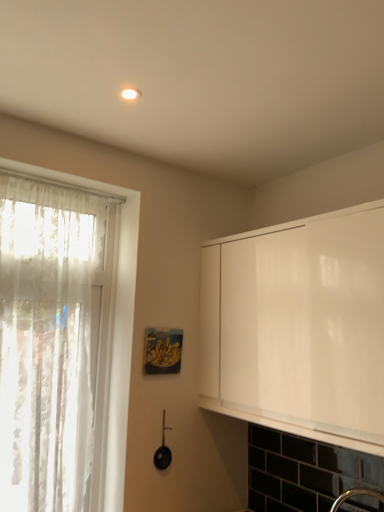
Describe the element at coordinates (298, 327) in the screenshot. This screenshot has height=512, width=384. I see `white matte cabinet at right` at that location.

The image size is (384, 512). What are the coordinates of `matte wooden picture frame at center` in the screenshot? It's located at (163, 351).

Looking at this image, between matte wooden picture frame at center and white matte cabinet at right, which one has less height?

matte wooden picture frame at center.

Based on their positions, is matte wooden picture frame at center located to the left or right of white matte cabinet at right?

Based on their positions, matte wooden picture frame at center is located to the left of white matte cabinet at right.

Does matte wooden picture frame at center touch white matte cabinet at right?

No, matte wooden picture frame at center is not beside white matte cabinet at right.

Where is `picture frame below the white matte cabinet at right (from the image's perspective)`? picture frame below the white matte cabinet at right (from the image's perspective) is located at coordinates (163, 351).

Measure the distance between white lace curtain at left and white matte cabinet at right.

white lace curtain at left is 81.24 centimeters away from white matte cabinet at right.

Could you tell me if white lace curtain at left is turned towards white matte cabinet at right?

No, white lace curtain at left does not turn towards white matte cabinet at right.

Which point is more distant from viewer, (61, 372) or (345, 355)?

Positioned behind is point (61, 372).

From the picture: Considering the positions of objects white lace curtain at left and white matte cabinet at right in the image provided, who is more to the left, white lace curtain at left or white matte cabinet at right?

Positioned to the left is white lace curtain at left.

From a real-world perspective, is white matte cabinet at right on white lace curtain at left?

Indeed, from a real-world perspective, white matte cabinet at right stands above white lace curtain at left.

Considering the positions of point (251, 242) and point (59, 494), is point (251, 242) closer or farther from the camera than point (59, 494)?

Point (251, 242).

Which object is wider, white matte cabinet at right or white lace curtain at left?

white matte cabinet at right is wider.

Could you tell me if white matte cabinet at right is facing white lace curtain at left?

Yes, white matte cabinet at right is facing white lace curtain at left.

Could you tell me if white matte cabinet at right is turned towards matte wooden picture frame at center?

Yes, white matte cabinet at right faces towards matte wooden picture frame at center.

Can you confirm if white matte cabinet at right is smaller than matte wooden picture frame at center?

Incorrect, white matte cabinet at right is not smaller in size than matte wooden picture frame at center.

Is white matte cabinet at right at the left side of matte wooden picture frame at center?

No, white matte cabinet at right is not to the left of matte wooden picture frame at center.

Considering the sizes of matte wooden picture frame at center and white lace curtain at left in the image, is matte wooden picture frame at center bigger or smaller than white lace curtain at left?

In the image, matte wooden picture frame at center appears to be smaller than white lace curtain at left.

Which is more to the left, matte wooden picture frame at center or white lace curtain at left?

Positioned to the left is white lace curtain at left.

Is matte wooden picture frame at center wider than white lace curtain at left?

No.

Do you think matte wooden picture frame at center is within white lace curtain at left, or outside of it?

matte wooden picture frame at center exists outside the volume of white lace curtain at left.

Considering the sizes of objects white lace curtain at left and matte wooden picture frame at center in the image provided, who is wider, white lace curtain at left or matte wooden picture frame at center?

white lace curtain at left is wider.

From a real-world perspective, relative to matte wooden picture frame at center, is white lace curtain at left vertically above or below?

white lace curtain at left is above matte wooden picture frame at center.

Identify the location of picture frame lying on the right of white lace curtain at left. This screenshot has width=384, height=512. pos(163,351).

Is white lace curtain at left far from matte wooden picture frame at center?

No, white lace curtain at left is not far away from matte wooden picture frame at center.

Identify the location of cabinetry above the matte wooden picture frame at center (from the image's perspective). This screenshot has width=384, height=512. (298, 327).

Find the location of `curtain below the white matte cabinet at right (from a real-world perspective)`. curtain below the white matte cabinet at right (from a real-world perspective) is located at coordinates (46, 343).

Which object lies further to the anchor point matte wooden picture frame at center, white matte cabinet at right or white lace curtain at left?

white matte cabinet at right is further to matte wooden picture frame at center.

Based on their spatial positions, is white lace curtain at left or white matte cabinet at right closer to matte wooden picture frame at center?

Based on the image, white lace curtain at left appears to be nearer to matte wooden picture frame at center.

Estimate the real-world distances between objects in this image. Which object is closer to white matte cabinet at right, matte wooden picture frame at center or white lace curtain at left?

Based on the image, matte wooden picture frame at center appears to be nearer to white matte cabinet at right.

Considering their positions, is matte wooden picture frame at center positioned closer to white lace curtain at left than white matte cabinet at right?

Based on the image, matte wooden picture frame at center appears to be nearer to white lace curtain at left.

From the picture: When comparing their distances from white lace curtain at left, does white matte cabinet at right or matte wooden picture frame at center seem further?

white matte cabinet at right lies further to white lace curtain at left than the other object.

From the image, which object appears to be nearer to white matte cabinet at right, white lace curtain at left or matte wooden picture frame at center?

matte wooden picture frame at center is closer to white matte cabinet at right.

Where is `picture frame between white lace curtain at left and white matte cabinet at right in the horizontal direction`? Image resolution: width=384 pixels, height=512 pixels. picture frame between white lace curtain at left and white matte cabinet at right in the horizontal direction is located at coordinates (163, 351).